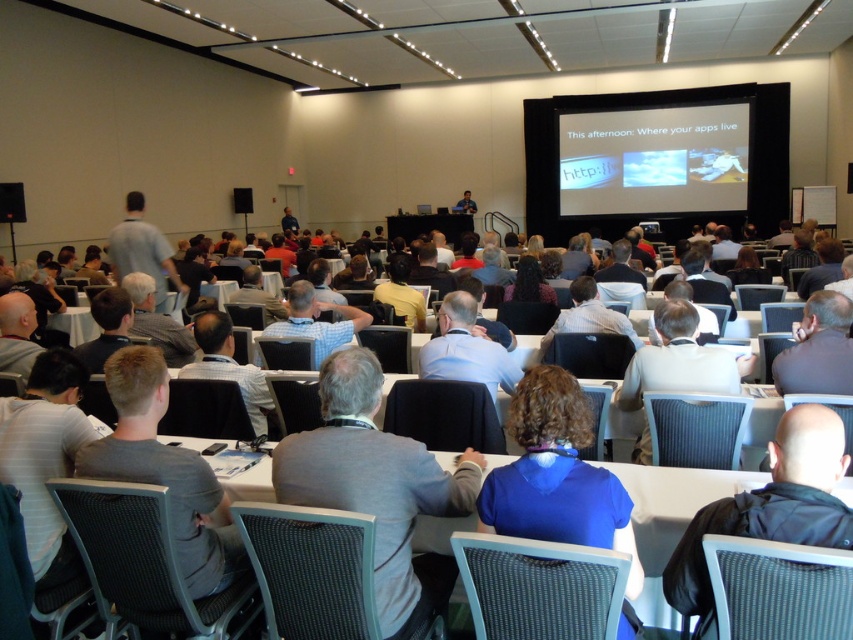
Question: Among these points, which one is farthest from the camera?

Choices:
 (A) (287, 476)
 (B) (541, 419)
 (C) (662, 189)

Answer: (C)

Question: Is gray fabric shirt at center behind blue matte shirt at center?

Choices:
 (A) no
 (B) yes

Answer: (B)

Question: Which of the following is the farthest from the observer?

Choices:
 (A) matte black projector screen at upper center
 (B) blue matte shirt at center
 (C) gray fabric shirt at center

Answer: (A)

Question: Is matte black projector screen at upper center in front of blue matte shirt at center?

Choices:
 (A) no
 (B) yes

Answer: (A)

Question: Estimate the real-world distances between objects in this image. Which object is farther from the blue matte shirt at center?

Choices:
 (A) gray fabric shirt at center
 (B) matte black projector screen at upper center

Answer: (B)

Question: Does gray fabric shirt at center have a lesser width compared to matte black projector screen at upper center?

Choices:
 (A) yes
 (B) no

Answer: (A)